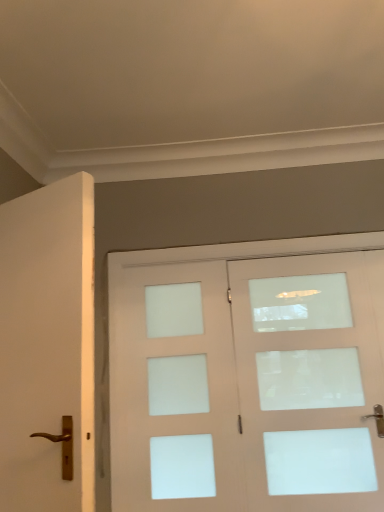
Question: In which direction should I rotate to look at matte white door at center, which is the second door from front to back?

Choices:
 (A) left
 (B) right

Answer: (B)

Question: Is matte white door at center, which is the second door from front to back, outside of white matte door at left, which ranks as the second door in back-to-front order?

Choices:
 (A) yes
 (B) no

Answer: (A)

Question: Is matte white door at center, acting as the first door starting from the back, bigger than white matte door at left, arranged as the first door when viewed from the left?

Choices:
 (A) no
 (B) yes

Answer: (B)

Question: Is matte white door at center, which is counted as the 1th door, starting from the right, closer to camera compared to white matte door at left, arranged as the first door when viewed from the left?

Choices:
 (A) yes
 (B) no

Answer: (B)

Question: Can you confirm if matte white door at center, which is the second door from front to back, is shorter than white matte door at left, acting as the first door starting from the front?

Choices:
 (A) no
 (B) yes

Answer: (A)

Question: From the image's perspective, is matte white door at center, acting as the first door starting from the back, under white matte door at left, arranged as the first door when viewed from the left?

Choices:
 (A) no
 (B) yes

Answer: (B)

Question: Does matte white door at center, acting as the first door starting from the back, have a greater height compared to white matte door at left, which ranks as the second door in back-to-front order?

Choices:
 (A) yes
 (B) no

Answer: (A)

Question: Considering the relative sizes of matte white door at center, acting as the first door starting from the back, and white frosted glass screen door at center in the image provided, is matte white door at center, acting as the first door starting from the back, taller than white frosted glass screen door at center?

Choices:
 (A) yes
 (B) no

Answer: (A)

Question: Would you say matte white door at center, acting as the first door starting from the back, is outside white frosted glass screen door at center?

Choices:
 (A) yes
 (B) no

Answer: (A)

Question: Can you confirm if matte white door at center, acting as the first door starting from the back, is positioned to the left of white frosted glass screen door at center?

Choices:
 (A) no
 (B) yes

Answer: (A)

Question: Would you say matte white door at center, which is the second door from front to back, contains white frosted glass screen door at center?

Choices:
 (A) no
 (B) yes

Answer: (A)

Question: Can you confirm if matte white door at center, acting as the first door starting from the back, is positioned to the right of white frosted glass screen door at center?

Choices:
 (A) yes
 (B) no

Answer: (A)

Question: Does matte white door at center, acting as the first door starting from the back, have a greater width compared to white frosted glass screen door at center?

Choices:
 (A) yes
 (B) no

Answer: (A)

Question: Would you say white matte door at left, which ranks as the second door in back-to-front order, contains matte white door at center, acting as the first door starting from the back?

Choices:
 (A) no
 (B) yes

Answer: (A)